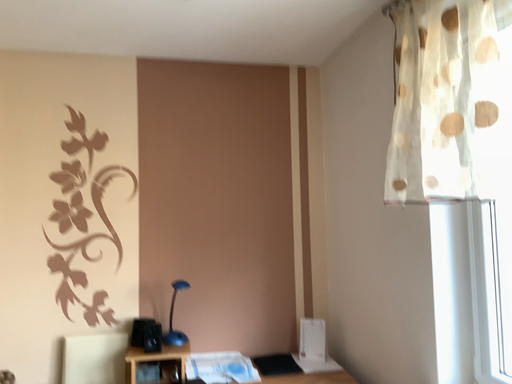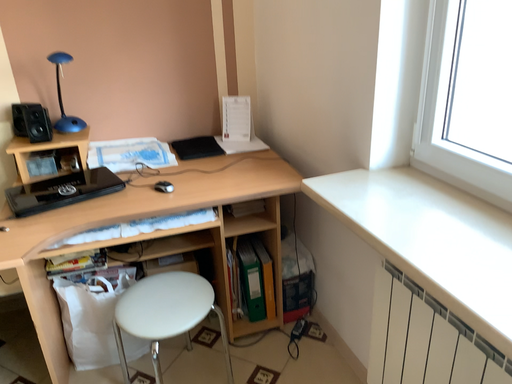
Question: How did the camera likely rotate when shooting the video?

Choices:
 (A) rotated left
 (B) rotated right

Answer: (B)